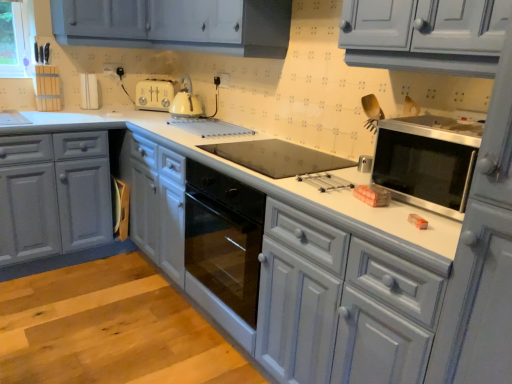
Locate an element on the screen. This screenshot has width=512, height=384. matte gray cabinet at lower left is located at coordinates pos(54,194).

The width and height of the screenshot is (512, 384). What do you see at coordinates (54, 194) in the screenshot?
I see `matte gray cabinet at lower left` at bounding box center [54, 194].

Measure the distance between matte gray cabinet at lower left and camera.

They are 7.14 feet apart.

Identify the location of matte gray cabinet at lower left. (54, 194).